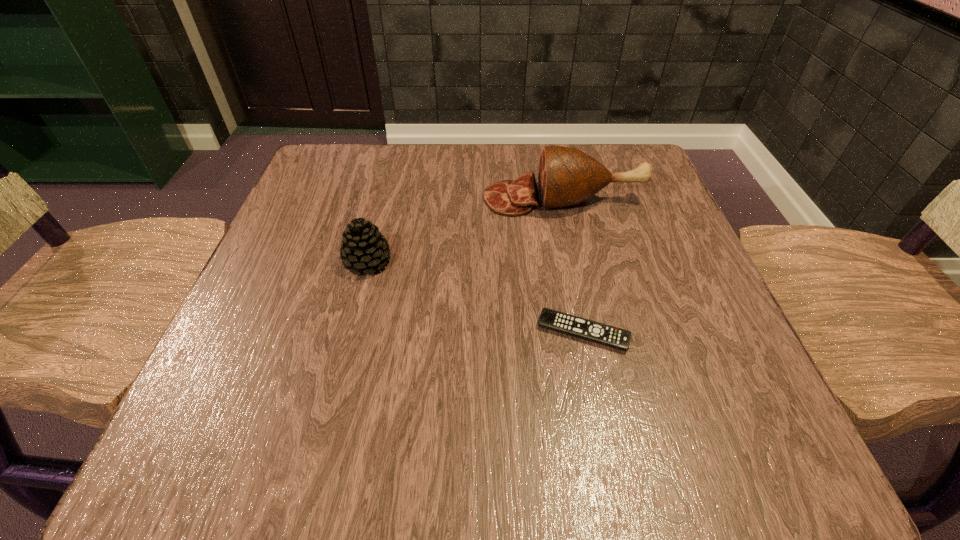
At what (x,y) coordinates should I click in order to perform the action: click on object that is at the far edge. Please return your answer as a coordinate pair (x, y). Looking at the image, I should click on (567, 176).

Locate an element on the screen. object at the left edge is located at coordinates (363, 247).

Identify the location of ham that is at the right edge. (567, 176).

Identify the location of remote control that is at the right edge. (575, 326).

Locate an element on the screen. This screenshot has width=960, height=540. object present at the far right corner is located at coordinates (567, 176).

I want to click on vacant space at the far edge, so click(x=384, y=174).

Find the location of a particular element. The width and height of the screenshot is (960, 540). blank space at the left edge of the desktop is located at coordinates (201, 391).

This screenshot has height=540, width=960. Identify the location of vacant space at the right edge. (611, 226).

Locate an element on the screen. The height and width of the screenshot is (540, 960). vacant space at the far left corner is located at coordinates (330, 192).

This screenshot has height=540, width=960. What are the coordinates of `vacant area at the far right corner` in the screenshot? It's located at (612, 144).